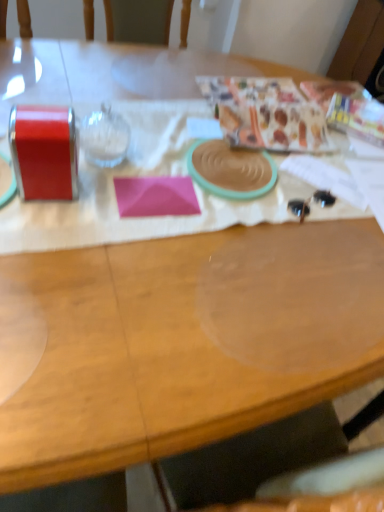
In order to click on free space in front of transparent glass at upper left in this screenshot , I will do `click(95, 204)`.